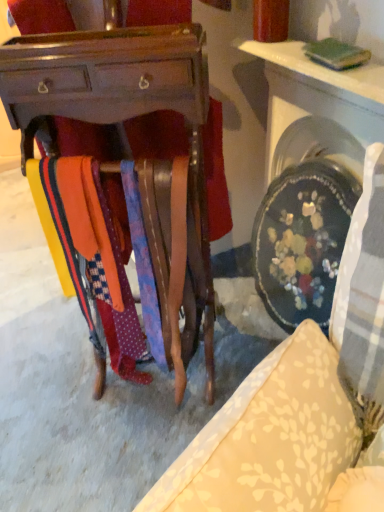
Locate an element on the screen. vacant area that is in front of orange fabric at center is located at coordinates (127, 419).